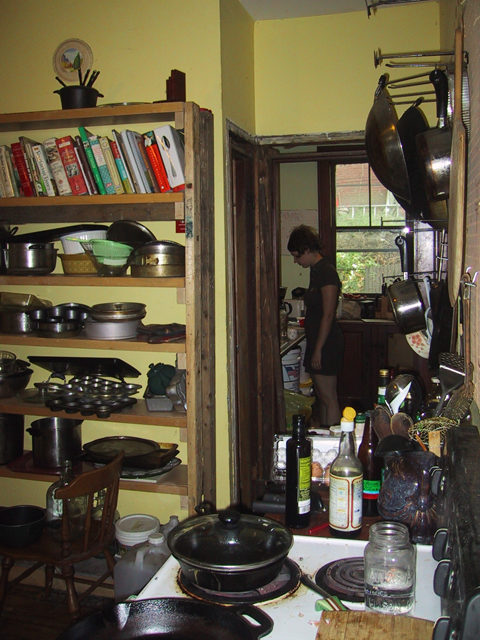
This screenshot has height=640, width=480. What are the coordinates of `cluttered house` in the screenshot? It's located at (234, 493).